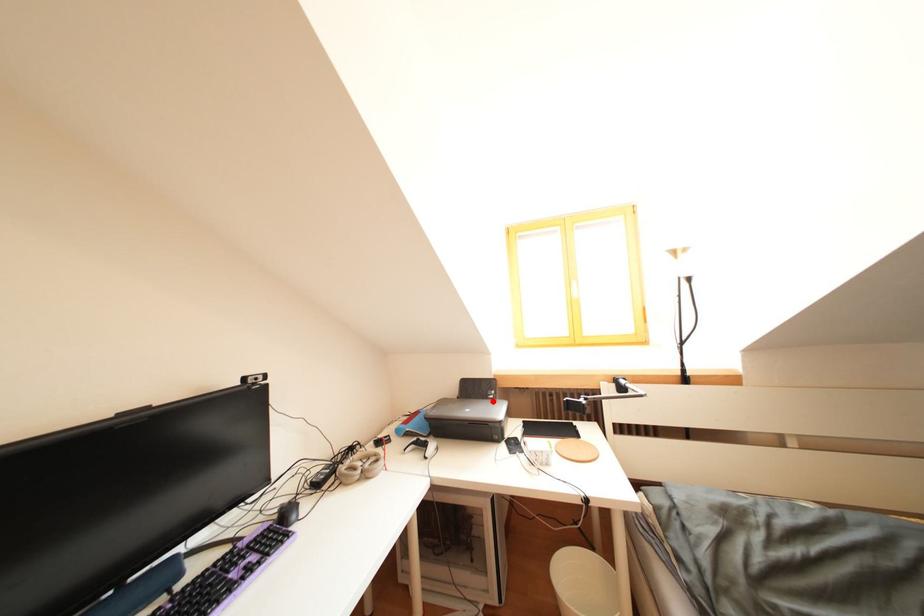
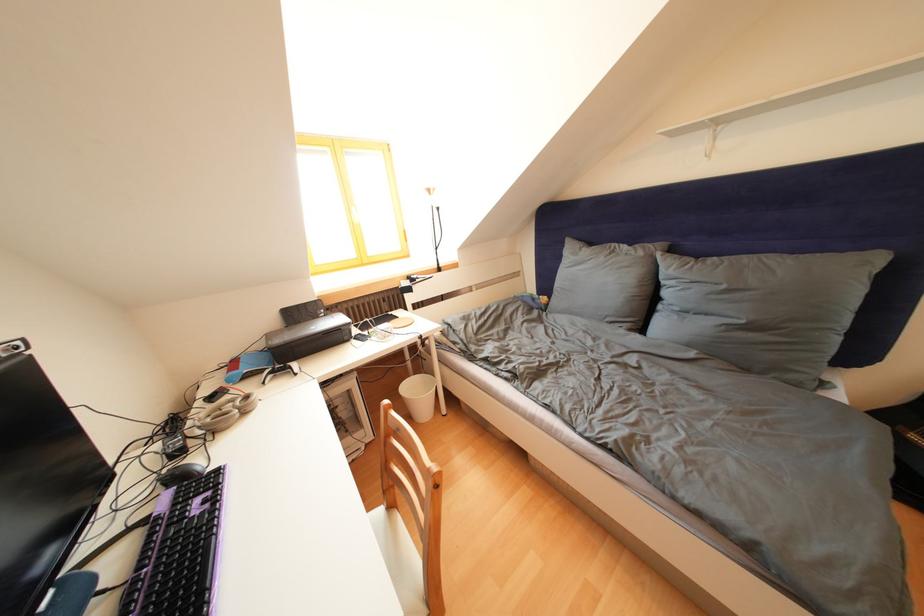
Question: I am providing you with two images of the same scene from different viewpoints. In image1, a red point is highlighted. Considering the same 3D point in image2, which of the following is correct?

Choices:
 (A) It is closer
 (B) It is farther

Answer: (A)